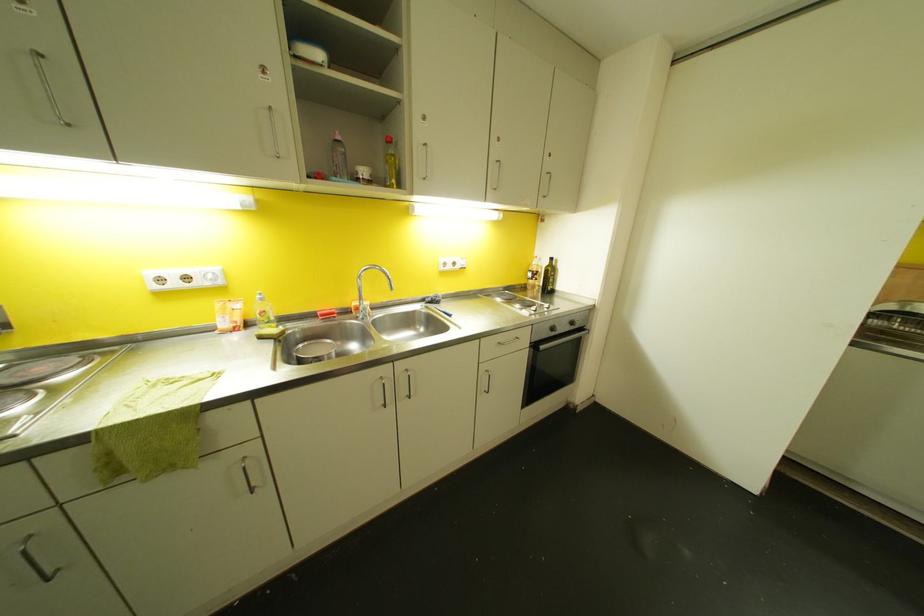
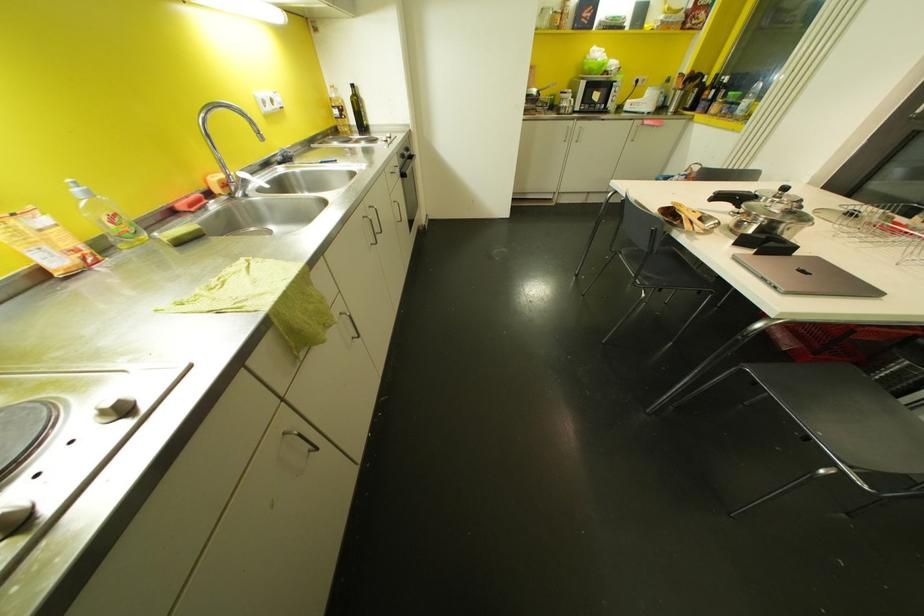
Find the pixel in the second image that matches [326,315] in the first image.

(198, 204)